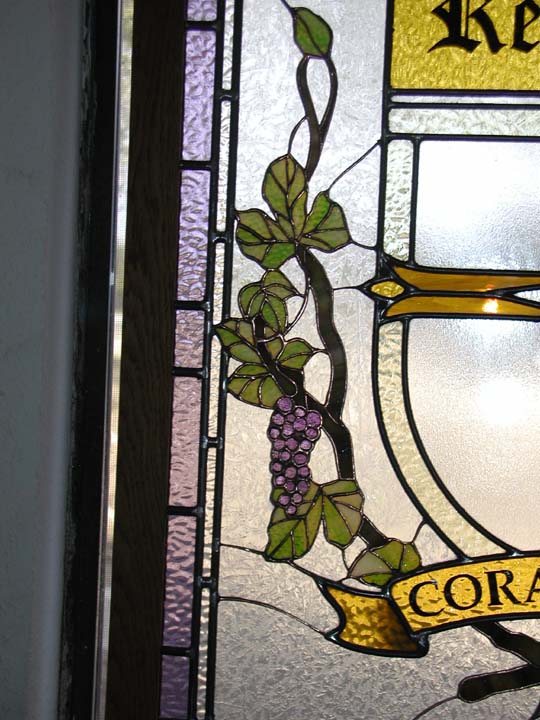
You are a GUI agent. You are given a task and a screenshot of the screen. Output one action in this format:
    pyautogui.click(x=<x>, y=<y>)
    Task: Click on the dark wood
    
    Given the screenshot: What is the action you would take?
    pyautogui.click(x=143, y=402)